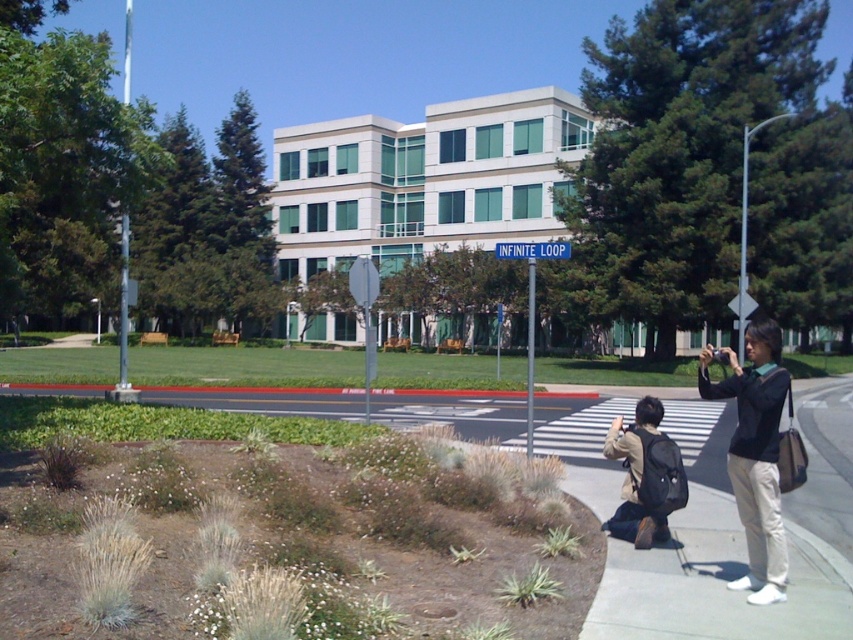
Question: Which of these objects is positioned farthest from the khaki cotton jacket at lower right?

Choices:
 (A) dark blue shirt at right
 (B) gravel textured pavement at lower left
 (C) blue metallic street sign at center

Answer: (C)

Question: Which object is the farthest from the gravel textured pavement at lower left?

Choices:
 (A) dark blue shirt at right
 (B) blue metallic street sign at center
 (C) khaki cotton jacket at lower right

Answer: (C)

Question: Which is farther from the dark blue shirt at right?

Choices:
 (A) khaki cotton jacket at lower right
 (B) blue metallic street sign at center
 (C) gravel textured pavement at lower left

Answer: (B)

Question: Considering the relative positions of dark blue shirt at right and khaki cotton jacket at lower right in the image provided, where is dark blue shirt at right located with respect to khaki cotton jacket at lower right?

Choices:
 (A) right
 (B) left

Answer: (A)

Question: Does gravel textured pavement at lower left appear on the right side of khaki cotton jacket at lower right?

Choices:
 (A) no
 (B) yes

Answer: (B)

Question: Does gravel textured pavement at lower left appear over khaki cotton jacket at lower right?

Choices:
 (A) no
 (B) yes

Answer: (A)